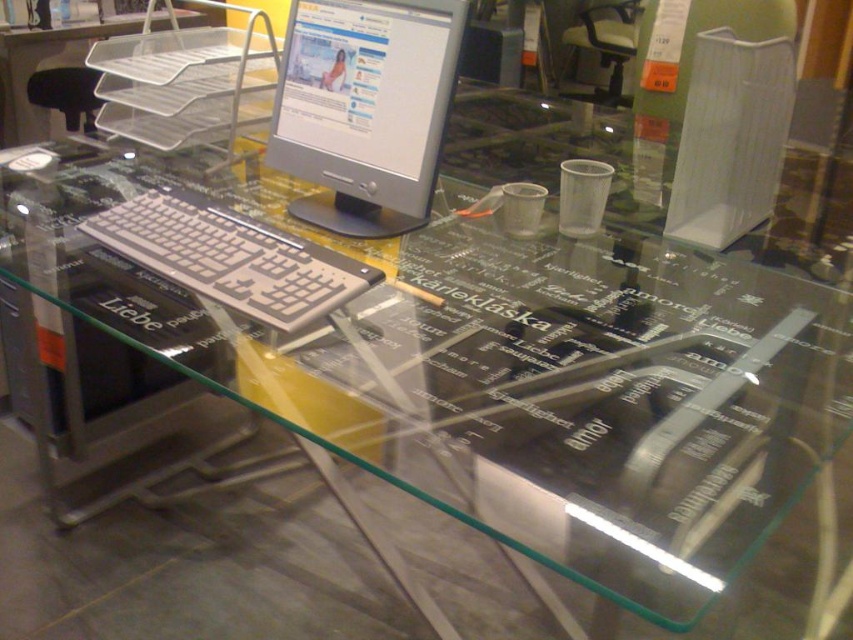
Is silver metallic computer monitor at upper center bigger than silver metallic keyboard at center?

Yes, silver metallic computer monitor at upper center is bigger than silver metallic keyboard at center.

Which is above, silver metallic computer monitor at upper center or silver metallic keyboard at center?

Positioned higher is silver metallic computer monitor at upper center.

Identify the location of silver metallic computer monitor at upper center. This screenshot has height=640, width=853. (364, 108).

Where is `silver metallic computer monitor at upper center`? The width and height of the screenshot is (853, 640). silver metallic computer monitor at upper center is located at coordinates (364, 108).